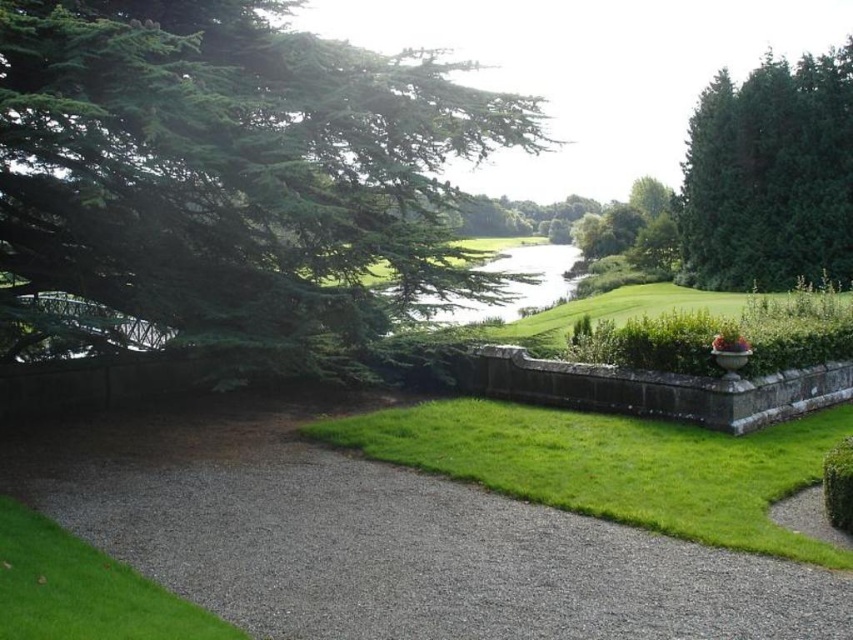
You are standing at the gravel pathway in the garden scene. You notice two points marked in the image. Which point is closer to you, point at coordinates (704, 436) or point at coordinates (843, 451)?

Point at coordinates (704, 436) is closer to you than point at coordinates (843, 451) because it is further to the viewer according to the description.

You are planning to walk along the gray gravel path at center and the green grass at lower left in the garden. Which surface area is bigger?

The gray gravel path at center is larger in size than the green grass at lower left, so the gravel path has a bigger surface area.